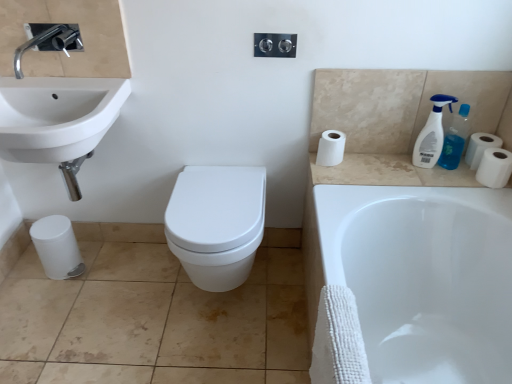
Question: Considering the relative positions of black plastic dispenser at upper center and white matte toilet paper at lower left, which appears as the 1th toilet paper when viewed from the left, in the image provided, is black plastic dispenser at upper center to the left of white matte toilet paper at lower left, which appears as the 1th toilet paper when viewed from the left, from the viewer's perspective?

Choices:
 (A) no
 (B) yes

Answer: (A)

Question: Is white matte toilet paper at lower left, which appears as the 1th toilet paper when viewed from the left, a part of black plastic dispenser at upper center?

Choices:
 (A) no
 (B) yes

Answer: (A)

Question: Considering the relative sizes of black plastic dispenser at upper center and white matte toilet paper at lower left, the 1th toilet paper in the bottom-to-top sequence, in the image provided, is black plastic dispenser at upper center wider than white matte toilet paper at lower left, the 1th toilet paper in the bottom-to-top sequence,?

Choices:
 (A) no
 (B) yes

Answer: (A)

Question: From the image's perspective, is black plastic dispenser at upper center below white matte toilet paper at lower left, which is the fourth toilet paper in top-to-bottom order?

Choices:
 (A) no
 (B) yes

Answer: (A)

Question: Considering the relative sizes of black plastic dispenser at upper center and white matte toilet paper at lower left, the 1th toilet paper in the bottom-to-top sequence, in the image provided, is black plastic dispenser at upper center shorter than white matte toilet paper at lower left, the 1th toilet paper in the bottom-to-top sequence,?

Choices:
 (A) yes
 (B) no

Answer: (A)

Question: Considering the positions of point (247, 244) and point (321, 137), is point (247, 244) closer or farther from the camera than point (321, 137)?

Choices:
 (A) farther
 (B) closer

Answer: (B)

Question: Is white glossy toilet at center situated inside white matte toilet paper at upper right, the 3th toilet paper positioned from the right, or outside?

Choices:
 (A) inside
 (B) outside

Answer: (B)

Question: Considering their positions, is white glossy toilet at center located in front of or behind white matte toilet paper at upper right, which appears as the second toilet paper when viewed from the left?

Choices:
 (A) front
 (B) behind

Answer: (A)

Question: Is white glossy toilet at center bigger or smaller than white matte toilet paper at upper right, placed as the 1th toilet paper when sorted from top to bottom?

Choices:
 (A) small
 (B) big

Answer: (B)

Question: Considering their positions, is white matte toilet paper at right, placed as the first toilet paper when sorted from right to left, located in front of or behind white plastic spray bottle at upper right, placed as the first cleaning product when sorted from left to right?

Choices:
 (A) front
 (B) behind

Answer: (B)

Question: Is white matte toilet paper at right, placed as the first toilet paper when sorted from right to left, spatially inside white plastic spray bottle at upper right, arranged as the second cleaning product when viewed from the right, or outside of it?

Choices:
 (A) inside
 (B) outside

Answer: (B)

Question: Is point (500, 137) positioned closer to the camera than point (418, 155)?

Choices:
 (A) farther
 (B) closer

Answer: (B)

Question: From a real-world perspective, is white matte toilet paper at right, acting as the 2th toilet paper starting from the top, physically located above or below white plastic spray bottle at upper right, placed as the first cleaning product when sorted from left to right?

Choices:
 (A) above
 (B) below

Answer: (B)

Question: Is white matte toilet paper at lower left, which is the fourth toilet paper in top-to-bottom order, taller or shorter than white matte toilet paper at right, the fourth toilet paper positioned from the left?

Choices:
 (A) short
 (B) tall

Answer: (B)

Question: Does point (61, 223) appear closer or farther from the camera than point (479, 157)?

Choices:
 (A) closer
 (B) farther

Answer: (B)